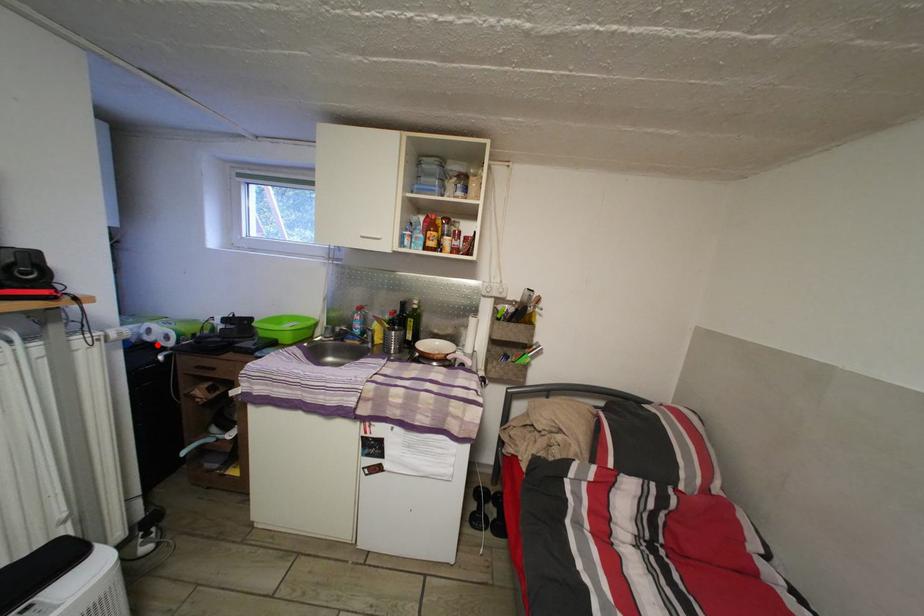
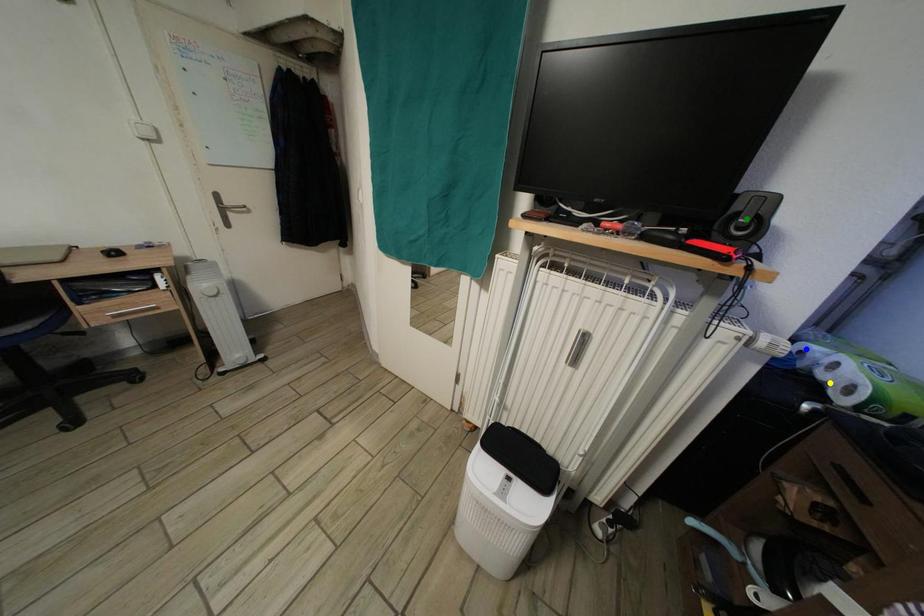
Question: I am providing you with two images of the same scene from different viewpoints. A red point is marked on the first image. You are given multiple points on the second image. In image 2, which mark is for the same physical point as the one in image 1?

Choices:
 (A) yellow point
 (B) green point
 (C) blue point

Answer: (A)